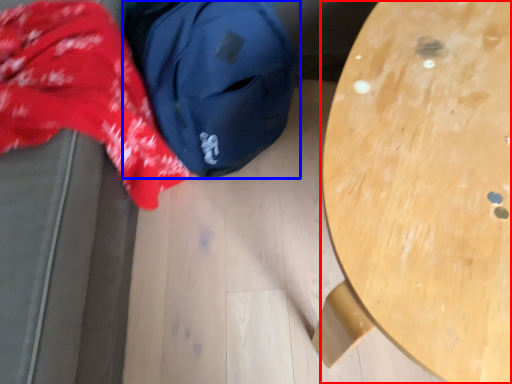
Question: Among these objects, which one is farthest to the camera, table (highlighted by a red box) or backpack (highlighted by a blue box)?

Choices:
 (A) table
 (B) backpack

Answer: (B)